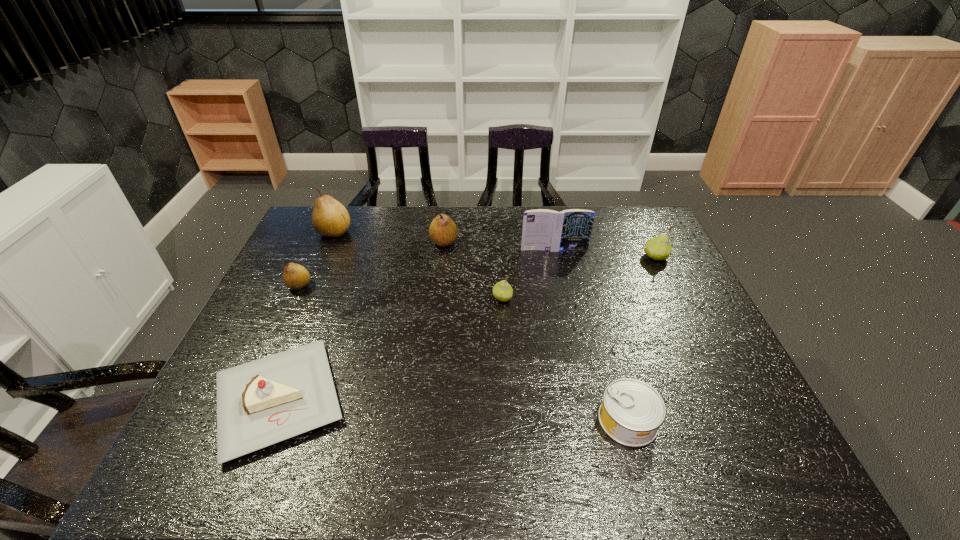
Find the location of a particular element. can present at the near edge is located at coordinates (632, 411).

In order to click on cake located in the left edge section of the desktop in this screenshot , I will do `click(260, 403)`.

Identify the location of object that is at the right edge. This screenshot has height=540, width=960. (658, 248).

Locate an element on the screen. This screenshot has height=540, width=960. object located in the far left corner section of the desktop is located at coordinates (330, 218).

I want to click on object that is at the near left corner, so click(x=260, y=403).

In the image, there is a desktop. Find the location of `free space at the far edge`. free space at the far edge is located at coordinates (409, 210).

Locate an element on the screen. free space at the near edge is located at coordinates (585, 449).

In the image, there is a desktop. Identify the location of free space at the left edge. (329, 271).

Image resolution: width=960 pixels, height=540 pixels. I want to click on free space at the right edge, so click(x=710, y=395).

You are a GUI agent. You are given a task and a screenshot of the screen. Output one action in this format:
    pyautogui.click(x=<x>, y=<y>)
    Task: Click on the free region at the near right corner of the desktop
    
    Given the screenshot: What is the action you would take?
    pyautogui.click(x=715, y=447)